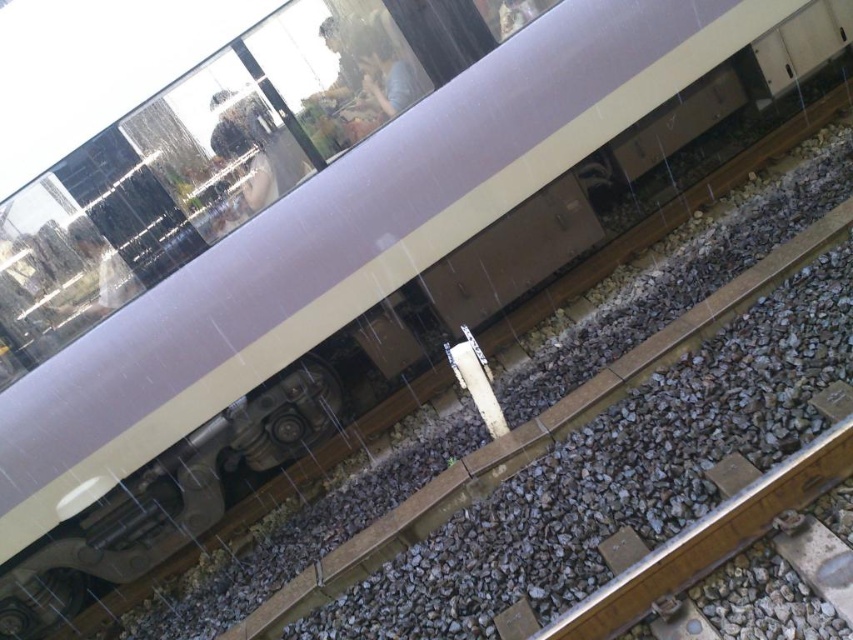
Question: Is transparent glass train window at upper center to the right of gray gravel at lower right from the viewer's perspective?

Choices:
 (A) no
 (B) yes

Answer: (A)

Question: Which object appears farthest from the camera in this image?

Choices:
 (A) transparent glass train window at upper center
 (B) gray gravel at lower right

Answer: (A)

Question: Which object appears farthest from the camera in this image?

Choices:
 (A) transparent glass train window at upper center
 (B) gray gravel at lower right

Answer: (A)

Question: Which point is farther to the camera?

Choices:
 (A) gray gravel at lower right
 (B) transparent glass train window at upper center

Answer: (B)

Question: In this image, where is transparent glass train window at upper center located relative to gray gravel at lower right?

Choices:
 (A) above
 (B) below

Answer: (A)

Question: Is transparent glass train window at upper center below gray gravel at lower right?

Choices:
 (A) yes
 (B) no

Answer: (B)